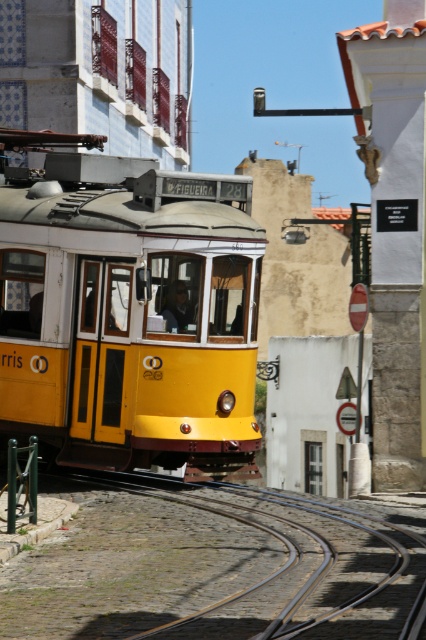
Question: From the image, what is the correct spatial relationship of yellow matte train at center in relation to black metal train track at lower center?

Choices:
 (A) right
 (B) left

Answer: (B)

Question: Which of the following is the farthest from the observer?

Choices:
 (A) yellow matte train at center
 (B) black metal train track at lower center

Answer: (A)

Question: Is yellow matte train at center bigger than black metal train track at lower center?

Choices:
 (A) no
 (B) yes

Answer: (B)

Question: Can you confirm if yellow matte train at center is positioned to the right of black metal train track at lower center?

Choices:
 (A) yes
 (B) no

Answer: (B)

Question: Among these points, which one is nearest to the camera?

Choices:
 (A) (42, 176)
 (B) (347, 602)

Answer: (B)